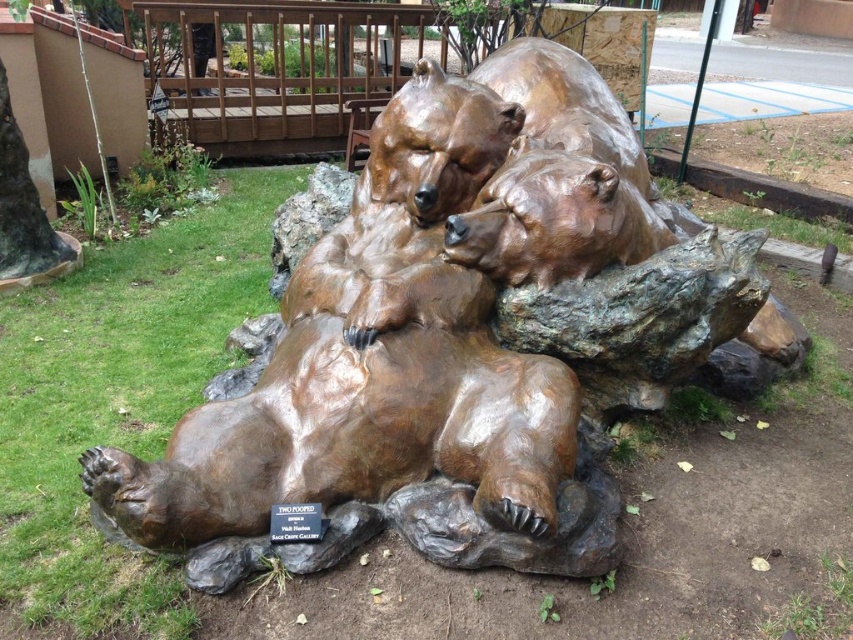
Is bronze bear sculpture at center shorter than bronze bear at center?

In fact, bronze bear sculpture at center may be taller than bronze bear at center.

Which of these two, bronze bear sculpture at center or bronze bear at center, stands shorter?

With less height is bronze bear at center.

Find the location of `bronze bear sculpture at center`. bronze bear sculpture at center is located at coordinates [x=438, y=362].

Locate an element on the screen. This screenshot has width=853, height=640. bronze bear sculpture at center is located at coordinates (438, 362).